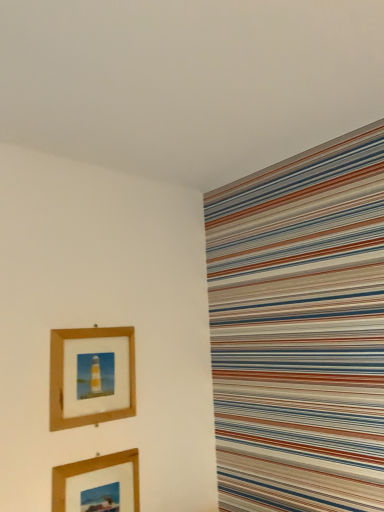
Question: Would you say wooden picture frame at upper left, the second picture frame in the bottom-to-top sequence, is to the left or to the right of wooden picture frame at lower left, acting as the first picture frame starting from the bottom, in the picture?

Choices:
 (A) left
 (B) right

Answer: (A)

Question: From the image's perspective, is wooden picture frame at upper left, the second picture frame in the bottom-to-top sequence, located above or below wooden picture frame at lower left, positioned as the 2th picture frame in top-to-bottom order?

Choices:
 (A) below
 (B) above

Answer: (B)

Question: Looking at their shapes, would you say wooden picture frame at upper left, the second picture frame in the bottom-to-top sequence, is wider or thinner than wooden picture frame at lower left, acting as the first picture frame starting from the bottom?

Choices:
 (A) thin
 (B) wide

Answer: (B)

Question: Is wooden picture frame at lower left, positioned as the 2th picture frame in top-to-bottom order, bigger or smaller than wooden picture frame at upper left, the second picture frame in the bottom-to-top sequence?

Choices:
 (A) big
 (B) small

Answer: (B)

Question: Is wooden picture frame at lower left, positioned as the 2th picture frame in top-to-bottom order, taller or shorter than wooden picture frame at upper left, which is counted as the 1th picture frame, starting from the top?

Choices:
 (A) short
 (B) tall

Answer: (A)

Question: Is wooden picture frame at lower left, positioned as the 2th picture frame in top-to-bottom order, to the left or to the right of wooden picture frame at upper left, which is counted as the 1th picture frame, starting from the top, in the image?

Choices:
 (A) right
 (B) left

Answer: (A)

Question: From a real-world perspective, is wooden picture frame at lower left, acting as the first picture frame starting from the bottom, positioned above or below wooden picture frame at upper left, the second picture frame in the bottom-to-top sequence?

Choices:
 (A) below
 (B) above

Answer: (A)